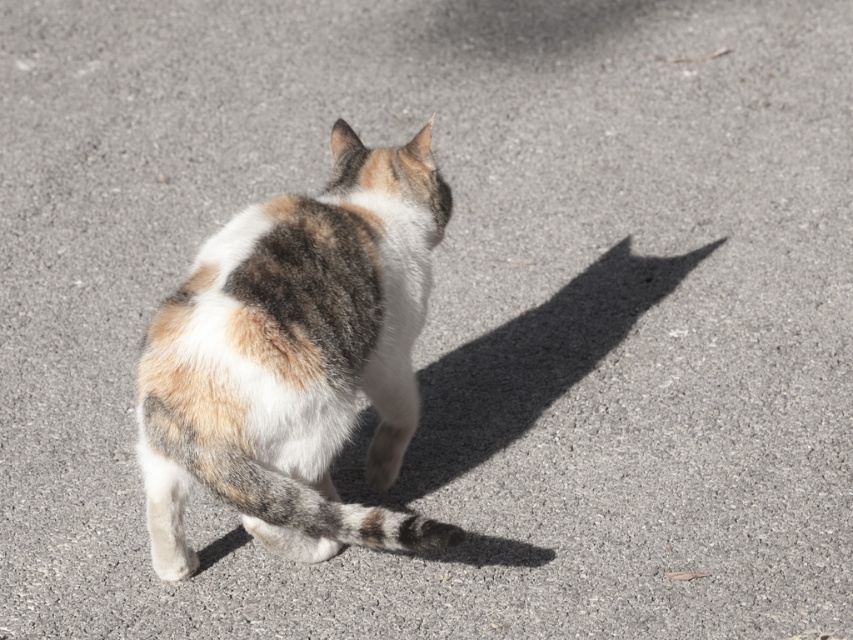
Is calico fur cat at center closer to the viewer compared to gray striped tail at center?

No, it is not.

Is point (352, 179) less distant than point (228, 497)?

No, (352, 179) is further to viewer.

Between point (424, 156) and point (293, 483), which one is positioned behind?

The point (424, 156) is more distant.

The image size is (853, 640). Identify the location of calico fur cat at center. (294, 358).